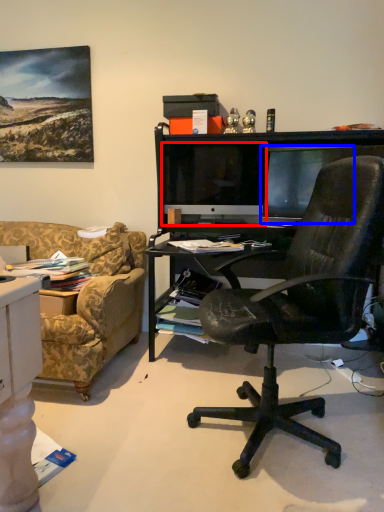
Question: Which of the following is the farthest to the observer, computer monitor (highlighted by a red box) or computer monitor (highlighted by a blue box)?

Choices:
 (A) computer monitor
 (B) computer monitor

Answer: (A)